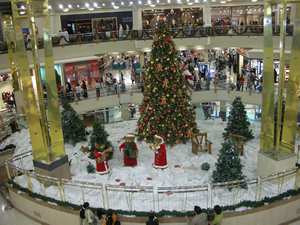
This screenshot has height=225, width=300. What are the coordinates of `pillar` in the screenshot? It's located at (53, 107), (268, 105).